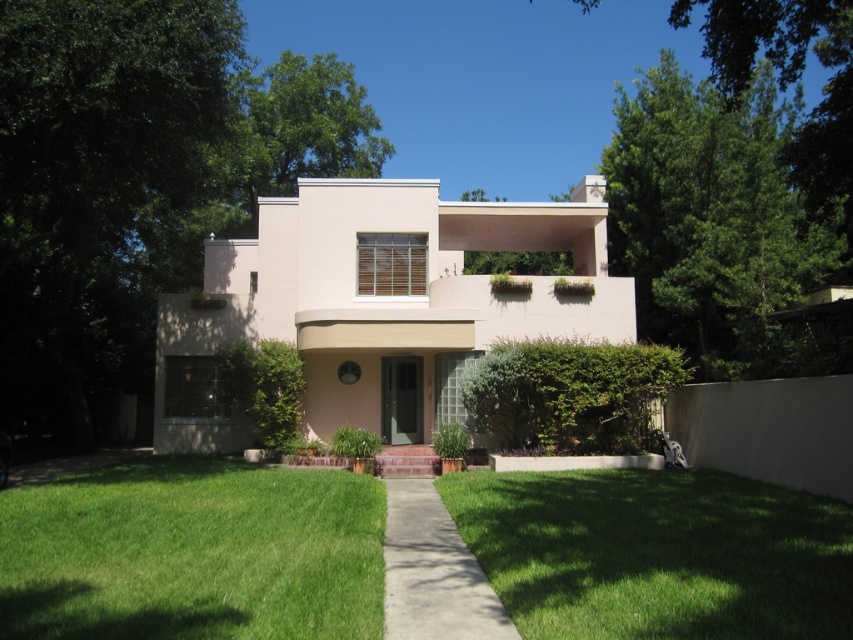
You are standing at the entrance of the beige concrete villa at center and want to walk towards the green grass at lower left. In which direction should you go?

You should go to the left because the beige concrete villa at center is to the right of green grass at lower left, so moving left from the villa will lead you toward the grass.

You are standing at the entrance of the modern house and want to take a photo of the green leafy tree at left. If your camera has a maximum focus range of 10 meters, will you be able to capture the tree clearly?

The green leafy tree at left is 11.00 meters away from the camera, which exceeds the camera maximum focus range of 10 meters. Therefore, you won not be able to capture the tree clearly.